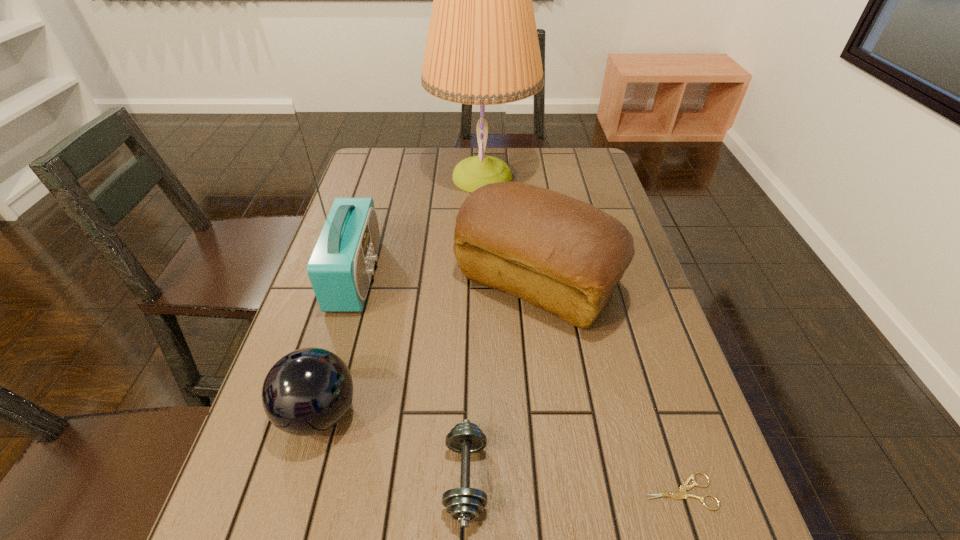
Find the location of `blank space located 0.200m on the front panel of the second tallest object`. blank space located 0.200m on the front panel of the second tallest object is located at coordinates (455, 275).

The width and height of the screenshot is (960, 540). What are the coordinates of `vacant area situated 0.310m on the left of the bread` in the screenshot? It's located at (332, 284).

The height and width of the screenshot is (540, 960). What are the coordinates of `vacant space located on the side of the bowling ball with the finger holes` in the screenshot? It's located at (446, 413).

Find the location of a particular element. The width and height of the screenshot is (960, 540). free space located on the left of the dumbbell is located at coordinates (251, 478).

Where is `free space located 0.230m on the back of the shortest object`? free space located 0.230m on the back of the shortest object is located at coordinates (639, 364).

Identify the location of object situated at the far edge. (482, 48).

At what (x,y) coordinates should I click in order to perform the action: click on radio receiver present at the left edge. Please return your answer as a coordinate pair (x, y). The image size is (960, 540). Looking at the image, I should click on (340, 268).

This screenshot has height=540, width=960. I want to click on bowling ball situated at the left edge, so click(x=306, y=392).

You are a GUI agent. You are given a task and a screenshot of the screen. Output one action in this format:
    pyautogui.click(x=<x>, y=<y>)
    Task: Click on the bread that is at the right edge
    Image resolution: width=960 pixels, height=540 pixels.
    Given the screenshot: What is the action you would take?
    pyautogui.click(x=565, y=256)

The height and width of the screenshot is (540, 960). What are the coordinates of `shears positioned at the right edge` in the screenshot? It's located at (682, 494).